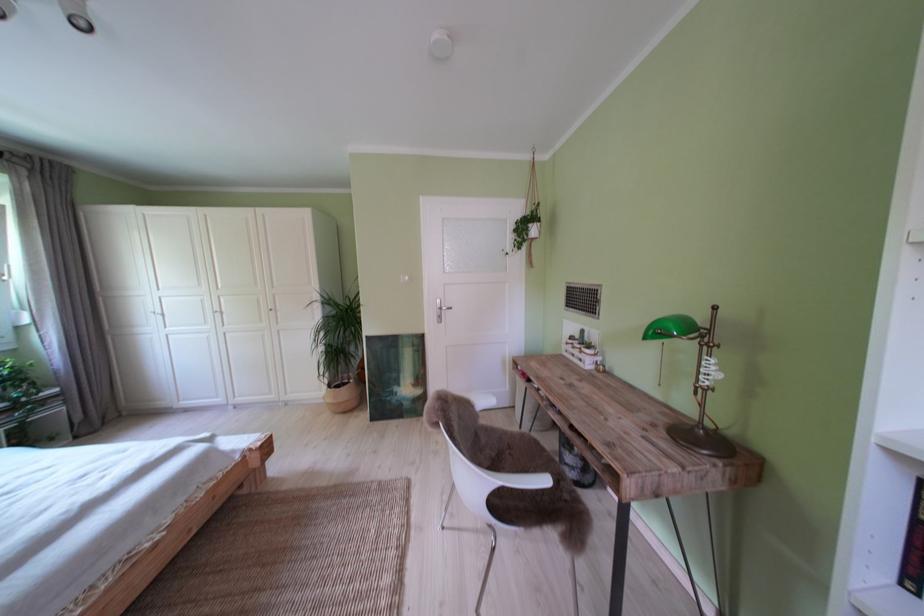
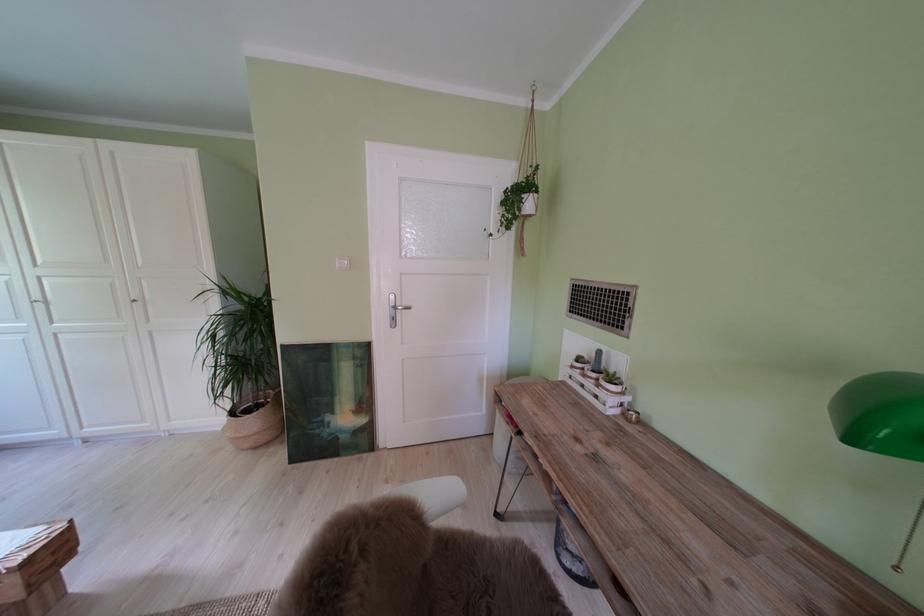
Question: The first image is from the beginning of the video and the second image is from the end. How did the camera likely rotate when shooting the video?

Choices:
 (A) Left
 (B) Right
 (C) Up
 (D) Down

Answer: (B)